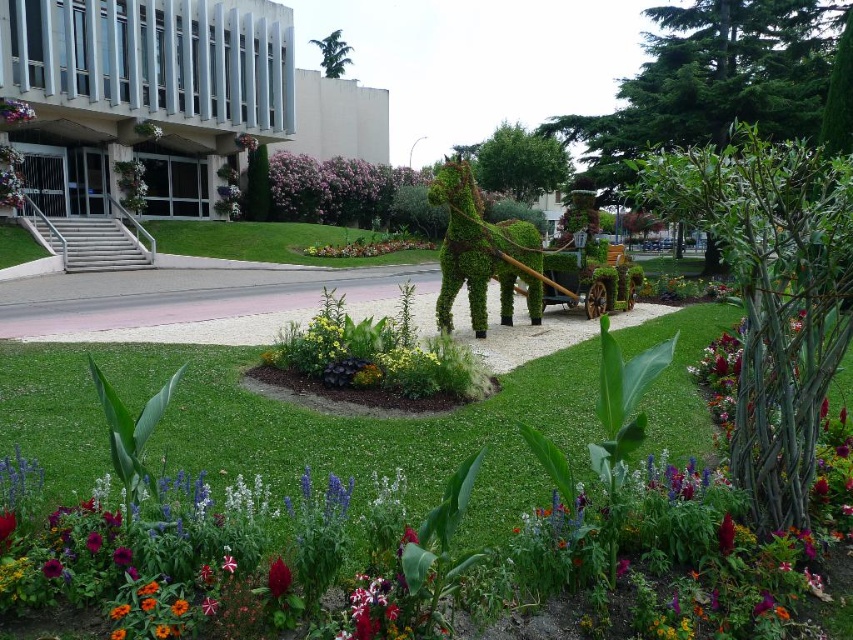
In the scene shown: You are a gardener who needs to place a new decorative statue between the green leafy horse at center and the vivid red petal at center. The statue is 3 meters wide. Is there enough space between them to place the statue without moving either object?

The distance between the green leafy horse at center and the vivid red petal at center is 6.72 meters. Since the statue is 3 meters wide, there is sufficient space to place it between them without moving either object.

You are a gardener who wants to plant a new flower between the vivid crimson petal at lower center and the vivid red petal at center. Which petal should you place the new flower closer to if you want it to be taller than both?

You should place the new flower closer to the vivid crimson petal at lower center because it is taller than the vivid red petal at center, so the new flower will be taller than both if positioned near the taller one.

Looking at this image, you are standing in the garden and want to take a photo of the topiary sculpture. You notice two points marked in the scene, point (485, 330) and point (227, 566). Which point is closer to your camera position?

Point (227, 566) is closer to the camera position because it is less further than point (485, 330).